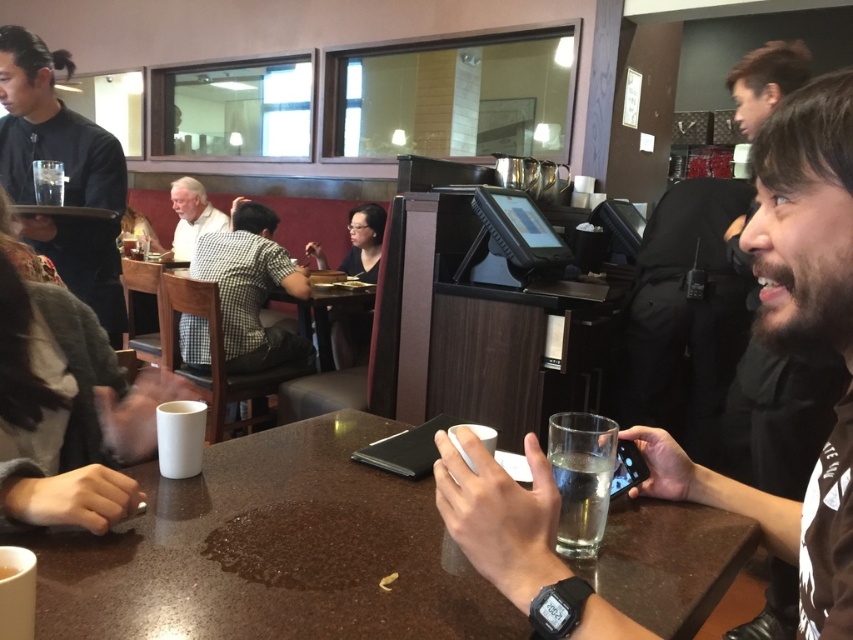
Question: Is marble table at center smaller than smooth brown shirt at right?

Choices:
 (A) yes
 (B) no

Answer: (A)

Question: Which point is closer to the camera?

Choices:
 (A) smooth brown shirt at right
 (B) marble table at center

Answer: (A)

Question: Considering the relative positions of smooth brown shirt at right and clear glass at center in the image provided, where is smooth brown shirt at right located with respect to clear glass at center?

Choices:
 (A) left
 (B) right

Answer: (B)

Question: Which of the following is the closest to the observer?

Choices:
 (A) clear glass at center
 (B) marble table at center
 (C) smooth brown shirt at right
 (D) black matte tray at upper left

Answer: (C)

Question: Among these points, which one is farthest from the camera?

Choices:
 (A) (96, 186)
 (B) (645, 513)
 (C) (759, 168)

Answer: (A)

Question: Observing the image, what is the correct spatial positioning of marble table at center in reference to smooth brown shirt at right?

Choices:
 (A) left
 (B) right

Answer: (A)